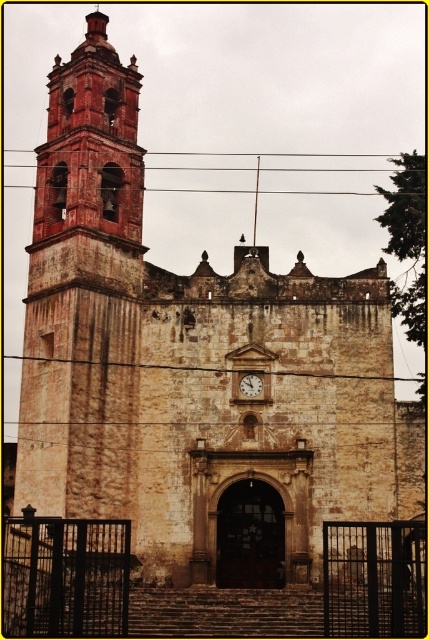
Question: Is brown stone clock at center below wooden clock at center?

Choices:
 (A) no
 (B) yes

Answer: (A)

Question: Is red brick bell tower at left positioned before wooden clock at center?

Choices:
 (A) no
 (B) yes

Answer: (B)

Question: Which is nearer to the brown stone clock at center?

Choices:
 (A) red brick bell tower at left
 (B) brown wire at upper center

Answer: (A)

Question: Where is brown wire at upper center located in relation to wooden clock at center in the image?

Choices:
 (A) above
 (B) below

Answer: (A)

Question: Among these points, which one is nearest to the camera?

Choices:
 (A) (63, 136)
 (B) (293, 372)

Answer: (B)

Question: Considering the real-world distances, which object is closest to the wooden clock at center?

Choices:
 (A) brown wire at upper center
 (B) brown stone clock at center

Answer: (B)